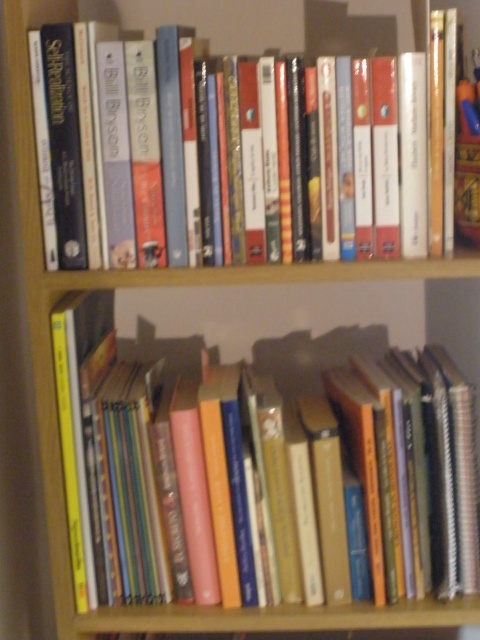
Question: Is the position of hardcover book at center less distant than that of hardcover book at upper center?

Choices:
 (A) no
 (B) yes

Answer: (A)

Question: Which point appears closest to the camera in this image?

Choices:
 (A) [264, 220]
 (B) [450, 596]

Answer: (A)

Question: Can you confirm if hardcover book at center is thinner than hardcover book at upper center?

Choices:
 (A) yes
 (B) no

Answer: (B)

Question: Does hardcover book at center have a lesser width compared to hardcover book at upper center?

Choices:
 (A) no
 (B) yes

Answer: (A)